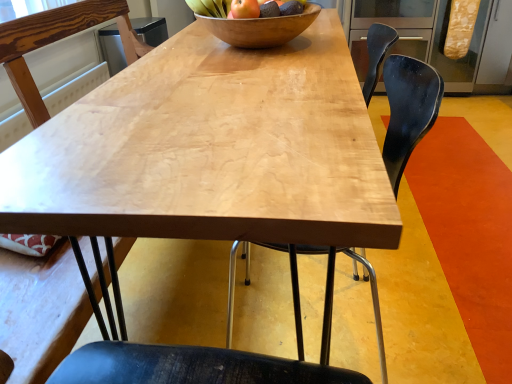
Where is `vacant space to the right of black matte chair at center, which is counted as the second chair, starting from the left`? This screenshot has height=384, width=512. vacant space to the right of black matte chair at center, which is counted as the second chair, starting from the left is located at coordinates (445, 235).